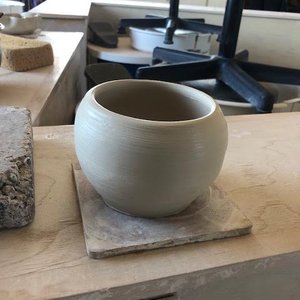
At what (x,y) coordinates should I click in order to perform the action: click on sponge. Please return your answer as a coordinate pair (x, y). Image resolution: width=300 pixels, height=300 pixels. Looking at the image, I should click on (26, 57).